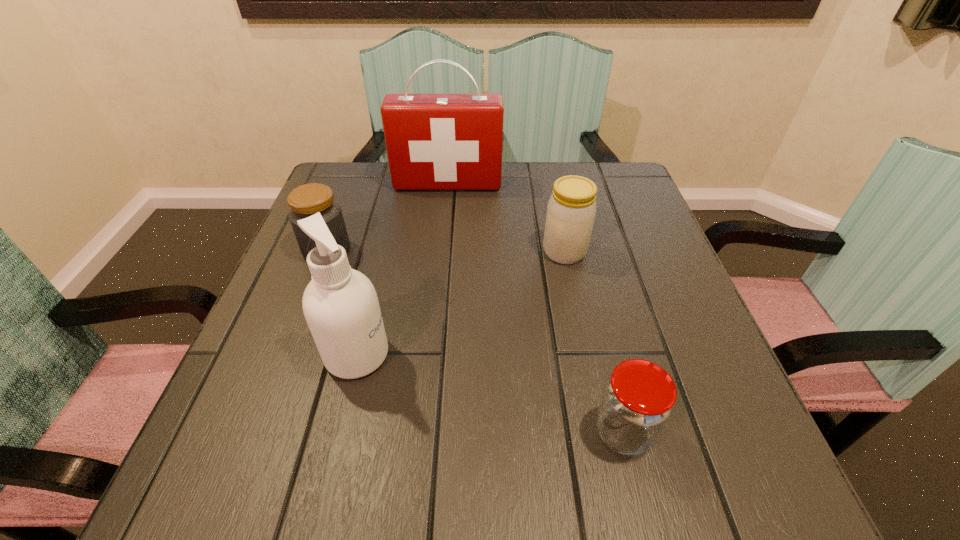
Identify the location of cleansing agent at the left edge. The image size is (960, 540). (340, 304).

Locate an element on the screen. jar that is at the left edge is located at coordinates (306, 200).

The image size is (960, 540). Identify the location of object that is at the right edge. (637, 401).

What are the coordinates of `object located in the near right corner section of the desktop` in the screenshot? It's located at (637, 401).

I want to click on vacant space at the far edge, so click(456, 193).

Identify the location of free location at the near edge of the desktop. This screenshot has height=540, width=960. (655, 499).

This screenshot has height=540, width=960. In the image, there is a desktop. Identify the location of vacant space at the left edge. (311, 440).

Identify the location of free region at the right edge. Image resolution: width=960 pixels, height=540 pixels. (617, 343).

What are the coordinates of `free region at the far left corner of the desktop` in the screenshot? It's located at tap(337, 189).

At what (x,y) coordinates should I click in order to perform the action: click on vacant position at the far right corner of the desktop. Please return your answer as a coordinate pair (x, y). The width and height of the screenshot is (960, 540). Looking at the image, I should click on (600, 198).